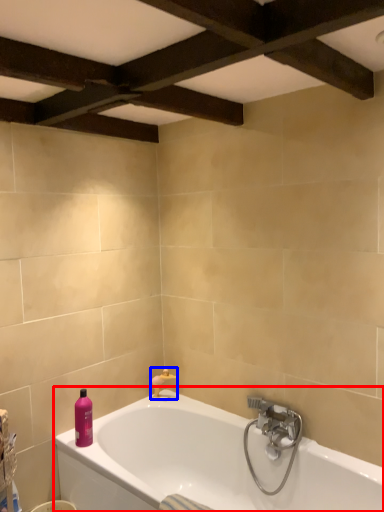
Question: Which object appears farthest to the camera in this image, bathtub (highlighted by a red box) or faucet (highlighted by a blue box)?

Choices:
 (A) bathtub
 (B) faucet

Answer: (B)